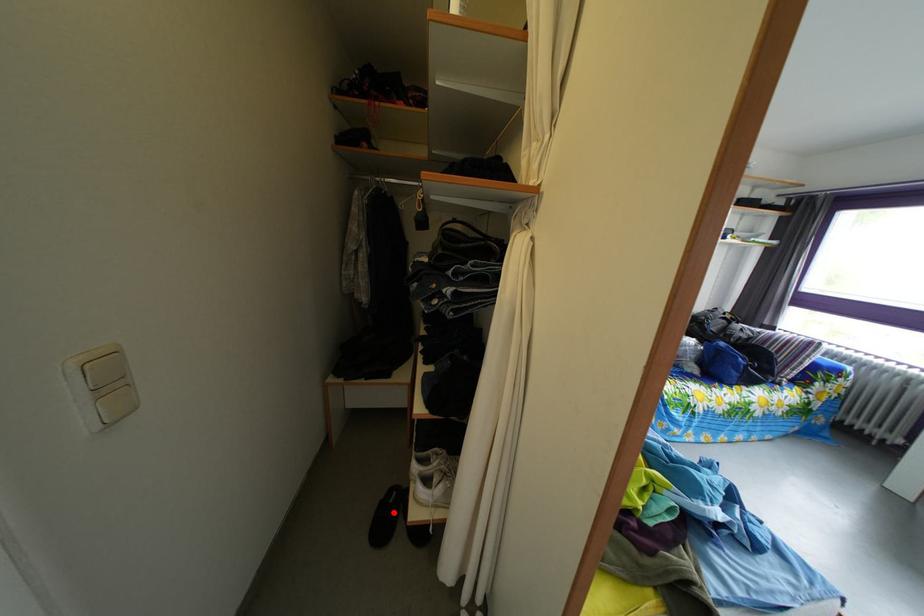
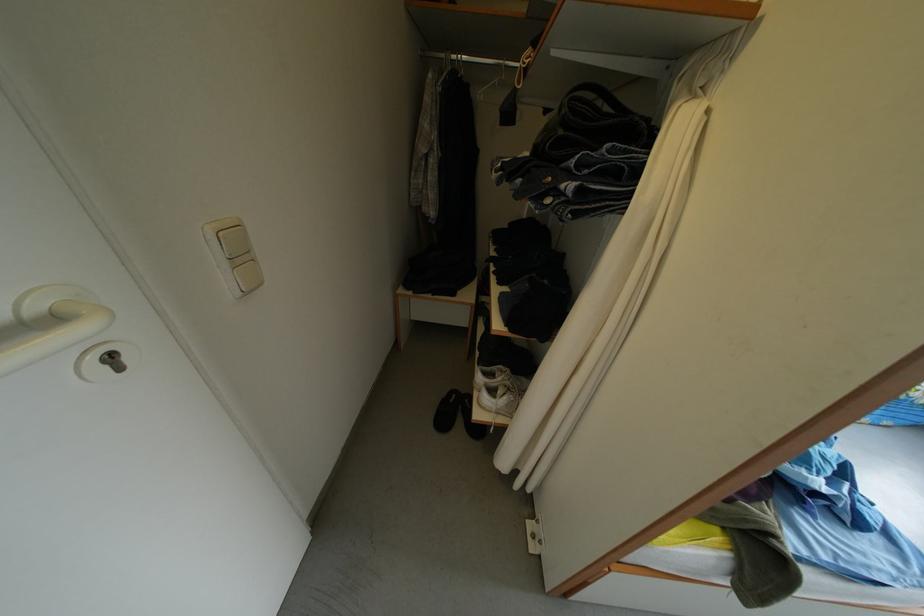
The point at the highlighted location is marked in the first image. Where is the corresponding point in the second image?

(456, 411)